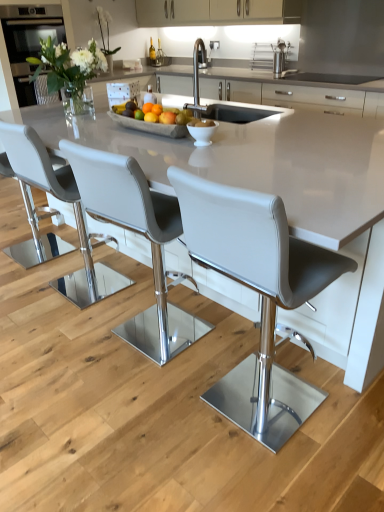
The image size is (384, 512). I want to click on free spot to the right of white leather stool at center, the 2th chair when ordered from right to left, so click(x=224, y=336).